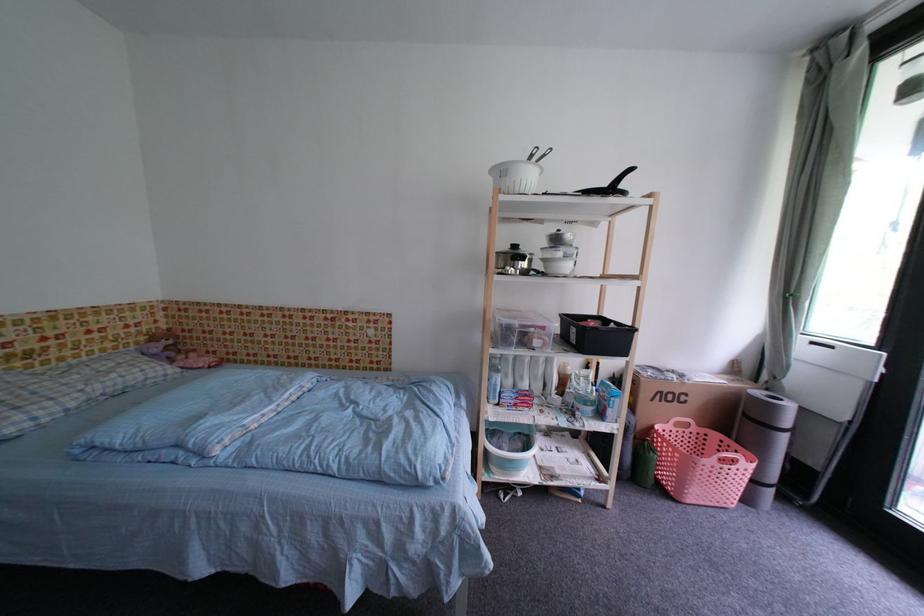
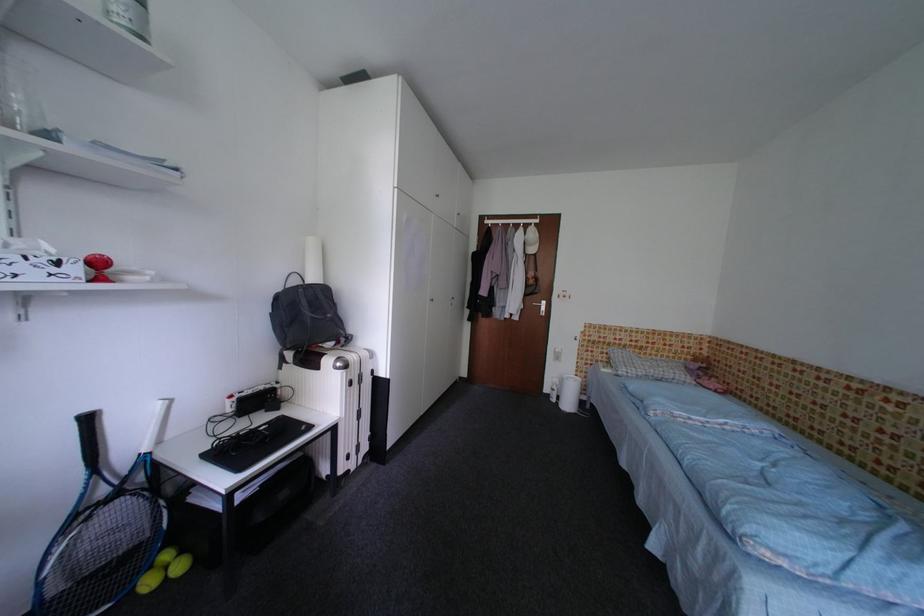
Question: The images are taken continuously from a first-person perspective. In which direction is your viewpoint rotating?

Choices:
 (A) Left
 (B) Right
 (C) Up
 (D) Down

Answer: (A)